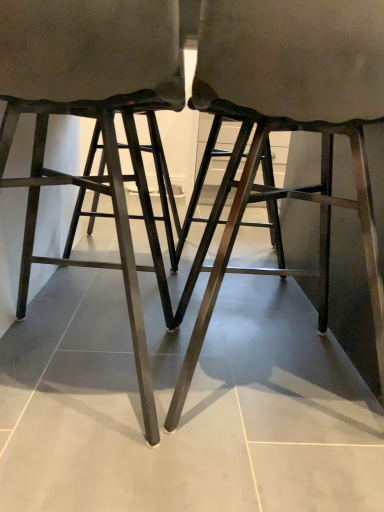
Question: Which direction should I rotate to look at metallic dark brown stool at center, arranged as the first stool when viewed from the right?

Choices:
 (A) right
 (B) left

Answer: (A)

Question: Which direction should I rotate to look at matte black stool at center, the 1th stool in the left-to-right sequence, — up or down?

Choices:
 (A) down
 (B) up

Answer: (B)

Question: Is there a large distance between metallic dark brown stool at center, arranged as the first stool when viewed from the right, and matte black stool at center, positioned as the second stool in right-to-left order?

Choices:
 (A) no
 (B) yes

Answer: (A)

Question: Does metallic dark brown stool at center, positioned as the 2th stool in left-to-right order, have a lesser width compared to matte black stool at center, positioned as the second stool in right-to-left order?

Choices:
 (A) yes
 (B) no

Answer: (B)

Question: Is metallic dark brown stool at center, arranged as the first stool when viewed from the right, next to matte black stool at center, the 1th stool in the left-to-right sequence?

Choices:
 (A) yes
 (B) no

Answer: (B)

Question: Does metallic dark brown stool at center, positioned as the 2th stool in left-to-right order, have a larger size compared to matte black stool at center, positioned as the second stool in right-to-left order?

Choices:
 (A) no
 (B) yes

Answer: (B)

Question: Can you confirm if metallic dark brown stool at center, positioned as the 2th stool in left-to-right order, is shorter than matte black stool at center, the 1th stool in the left-to-right sequence?

Choices:
 (A) no
 (B) yes

Answer: (A)

Question: Is metallic dark brown stool at center, arranged as the first stool when viewed from the right, completely or partially outside of matte black stool at center, the 1th stool in the left-to-right sequence?

Choices:
 (A) yes
 (B) no

Answer: (A)

Question: Is matte black stool at center, the 1th stool in the left-to-right sequence, not close to metallic dark brown stool at center, positioned as the 2th stool in left-to-right order?

Choices:
 (A) yes
 (B) no

Answer: (B)

Question: Would you say metallic dark brown stool at center, positioned as the 2th stool in left-to-right order, is part of matte black stool at center, positioned as the second stool in right-to-left order,'s contents?

Choices:
 (A) no
 (B) yes

Answer: (A)

Question: Is matte black stool at center, the 1th stool in the left-to-right sequence, closer to the viewer compared to metallic dark brown stool at center, arranged as the first stool when viewed from the right?

Choices:
 (A) yes
 (B) no

Answer: (A)

Question: Can you confirm if matte black stool at center, positioned as the second stool in right-to-left order, is smaller than metallic dark brown stool at center, arranged as the first stool when viewed from the right?

Choices:
 (A) no
 (B) yes

Answer: (B)

Question: Is matte black stool at center, the 1th stool in the left-to-right sequence, bigger than metallic dark brown stool at center, positioned as the 2th stool in left-to-right order?

Choices:
 (A) yes
 (B) no

Answer: (B)

Question: Is matte black stool at center, the 1th stool in the left-to-right sequence, behind metallic dark brown stool at center, arranged as the first stool when viewed from the right?

Choices:
 (A) no
 (B) yes

Answer: (A)

Question: From a real-world perspective, is metallic dark brown stool at center, arranged as the first stool when viewed from the right, positioned above or below matte black stool at center, positioned as the second stool in right-to-left order?

Choices:
 (A) above
 (B) below

Answer: (A)